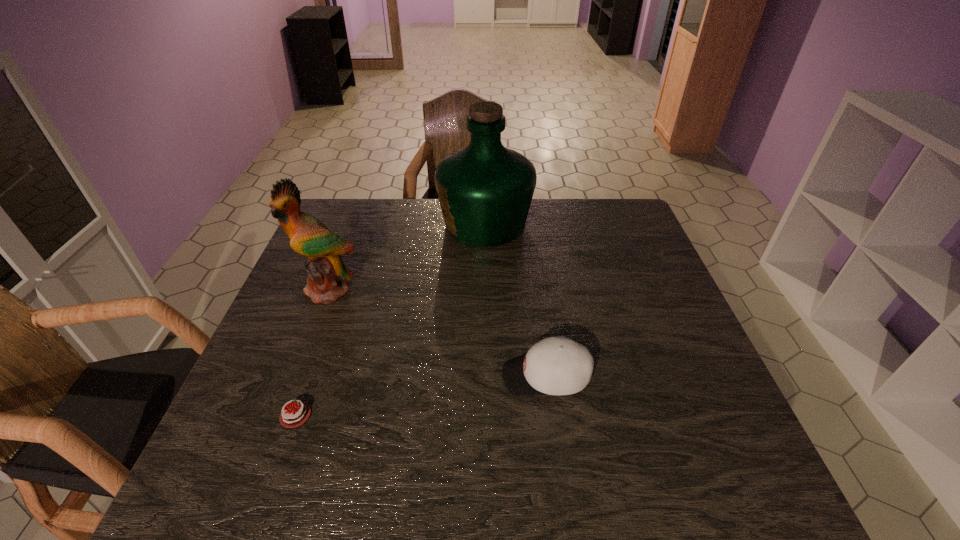
You are a GUI agent. You are given a task and a screenshot of the screen. Output one action in this format:
    pyautogui.click(x=<x>, y=<y>)
    Task: Click on the free location located on the front-facing side of the baseball cap
    
    Given the screenshot: What is the action you would take?
    pyautogui.click(x=452, y=376)

In order to click on vacant area located on the right of the chocolate cake in this screenshot , I will do `click(393, 415)`.

Where is `object that is at the far edge`? This screenshot has height=540, width=960. object that is at the far edge is located at coordinates (485, 190).

You are a GUI agent. You are given a task and a screenshot of the screen. Output one action in this format:
    pyautogui.click(x=<x>, y=<y>)
    Task: Click on the parrot that is at the left edge
    
    Given the screenshot: What is the action you would take?
    pyautogui.click(x=327, y=274)

Identify the location of chocolate cake present at the left edge. This screenshot has width=960, height=540. (294, 416).

You are a GUI agent. You are given a task and a screenshot of the screen. Output one action in this format:
    pyautogui.click(x=<x>, y=<y>)
    Task: Click on the blank space at the far edge
    Image resolution: width=960 pixels, height=540 pixels.
    Given the screenshot: What is the action you would take?
    pyautogui.click(x=388, y=230)

The image size is (960, 540). What are the coordinates of `free space at the near edge of the desktop` in the screenshot? It's located at (384, 461).

Identify the location of vacant space at the left edge of the desktop. Image resolution: width=960 pixels, height=540 pixels. (240, 393).

At what (x,y) coordinates should I click in order to perform the action: click on vacant space at the right edge. Please return your answer as a coordinate pair (x, y). This screenshot has height=540, width=960. Looking at the image, I should click on tap(693, 350).

The width and height of the screenshot is (960, 540). In the image, there is a desktop. What are the coordinates of `vacant space at the far left corner` in the screenshot? It's located at (342, 235).